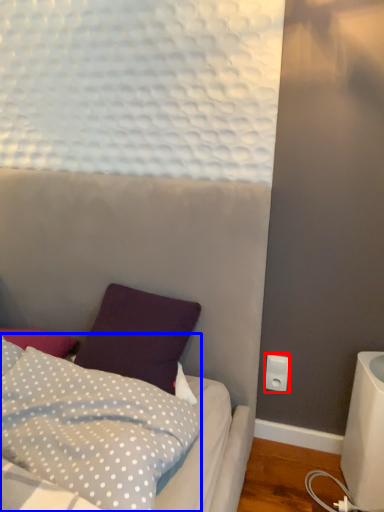
Question: Among these objects, which one is farthest to the camera, electric outlet (highlighted by a red box) or pillow (highlighted by a blue box)?

Choices:
 (A) electric outlet
 (B) pillow

Answer: (A)